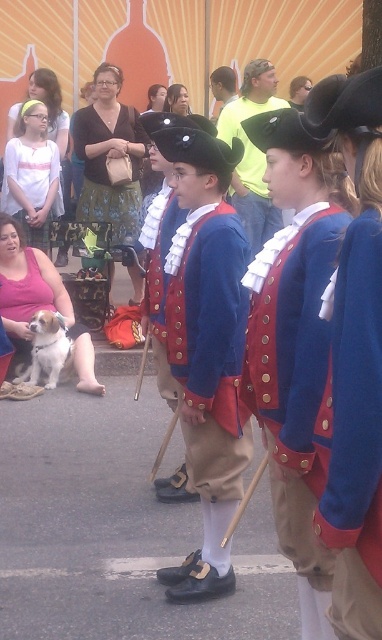
Looking at this image, does red velvet vest at center appear on the left side of white fur dog at lower left?

In fact, red velvet vest at center is to the right of white fur dog at lower left.

Is point (312, 298) less distant than point (53, 381)?

Yes, point (312, 298) is closer to viewer.

Locate an element on the screen. red velvet vest at center is located at coordinates (294, 387).

Does point (365, 554) come in front of point (244, 246)?

Yes.

Locate an element on the screen. blue woolen vest at center is located at coordinates (354, 433).

Who is lower down, white cotton shirt at upper left or white fur dog at lower left?

Positioned lower is white fur dog at lower left.

Does point (27, 192) come behind point (40, 360)?

Yes, point (27, 192) is behind point (40, 360).

Identify the location of white cotton shirt at upper left. (32, 188).